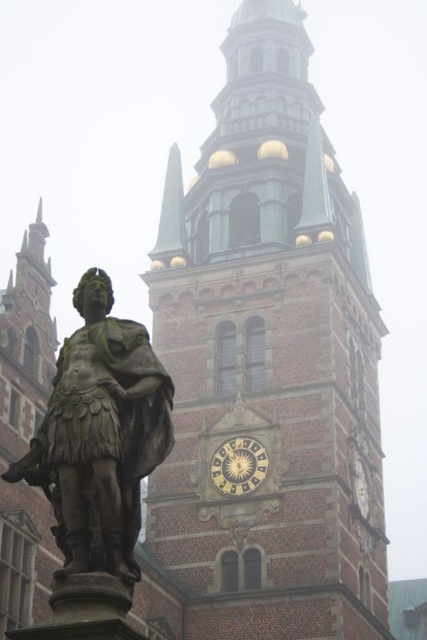
Can you confirm if brown brick tower at center is thinner than goldmetallicclock at center?

No, brown brick tower at center is not thinner than goldmetallicclock at center.

From the picture: Who is taller, brown brick tower at center or goldmetallicclock at center?

brown brick tower at center

Which is behind, point (213, 316) or point (262, 468)?

Positioned behind is point (213, 316).

This screenshot has width=427, height=640. I want to click on brown brick tower at center, so click(x=269, y=371).

Does green polished stone spire at upper center have a greater width compared to goldmetallicclock at center?

Incorrect, green polished stone spire at upper center's width does not surpass goldmetallicclock at center's.

Is the position of green polished stone spire at upper center more distant than that of goldmetallicclock at center?

That is True.

Who is more forward, (175,227) or (265,452)?

Point (265,452)

You are a GUI agent. You are given a task and a screenshot of the screen. Output one action in this format:
    pyautogui.click(x=<x>, y=<y>)
    Task: Click on the green polished stone spire at upper center
    The width and height of the screenshot is (427, 640).
    Given the screenshot: What is the action you would take?
    pyautogui.click(x=170, y=218)

Can you confirm if bronze statue at center is shorter than goldmetallicclock at center?

No, bronze statue at center is not shorter than goldmetallicclock at center.

Is bronze statue at center smaller than goldmetallicclock at center?

Incorrect, bronze statue at center is not smaller in size than goldmetallicclock at center.

Between point (128, 467) and point (233, 445), which one is positioned behind?

Point (233, 445)

You are a GUI agent. You are given a task and a screenshot of the screen. Output one action in this format:
    pyautogui.click(x=<x>, y=<y>)
    Task: Click on the bronze statue at center
    
    Given the screenshot: What is the action you would take?
    pyautogui.click(x=99, y=435)